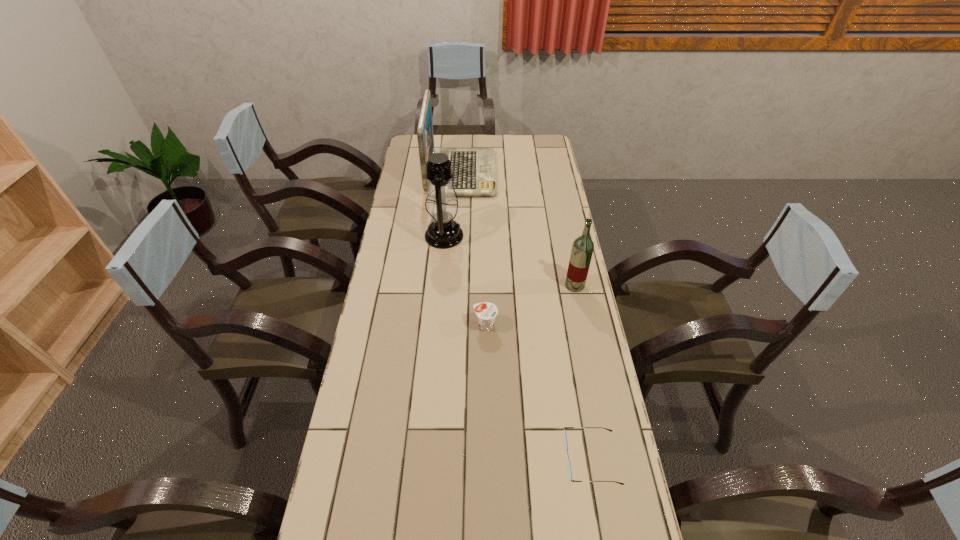
Locate an element on the screen. oil lamp is located at coordinates (443, 232).

Identify the location of the farthest object. The height and width of the screenshot is (540, 960). (474, 169).

This screenshot has width=960, height=540. In order to click on liquor in this screenshot , I will do `click(582, 249)`.

Where is `yogurt`? The height and width of the screenshot is (540, 960). yogurt is located at coordinates (486, 312).

Locate an element on the screen. Image resolution: width=960 pixels, height=540 pixels. the second nearest object is located at coordinates (486, 312).

Locate an element on the screen. The height and width of the screenshot is (540, 960). spectacles is located at coordinates (564, 435).

The height and width of the screenshot is (540, 960). Identify the location of the nearest object. (564, 435).

What are the coordinates of `vacant area located 0.240m on the right of the second farthest object` in the screenshot? It's located at (524, 236).

The width and height of the screenshot is (960, 540). I want to click on vacant space located on the screen of the farthest object, so click(511, 173).

Locate an element on the screen. vacant point located 0.330m on the front of the third farthest object is located at coordinates (593, 375).